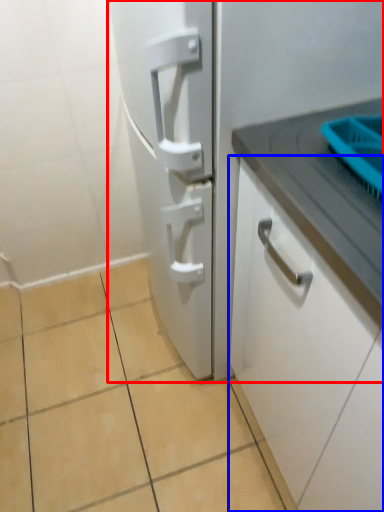
Question: Which object appears closest to the camera in this image, refrigerator (highlighted by a red box) or cabinetry (highlighted by a blue box)?

Choices:
 (A) refrigerator
 (B) cabinetry

Answer: (B)